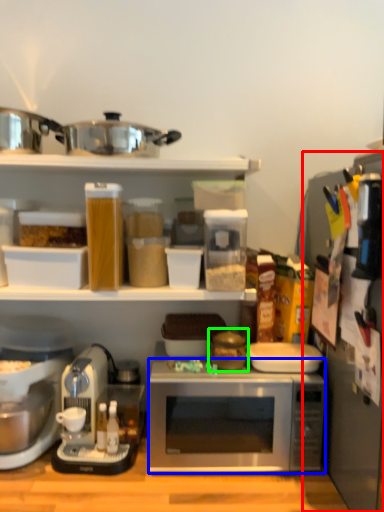
Question: Estimate the real-world distances between objects in this image. Which object is closer to appliance (highlighted by a red box), microwave oven (highlighted by a blue box) or appliance (highlighted by a green box)?

Choices:
 (A) microwave oven
 (B) appliance

Answer: (A)